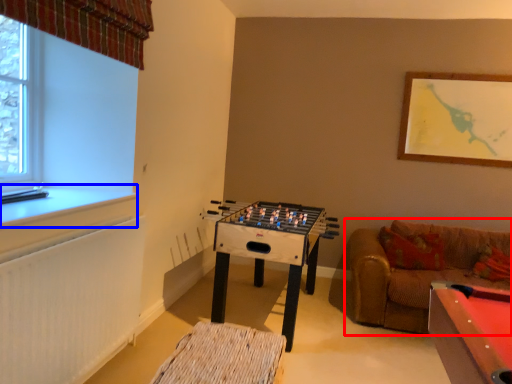
Question: Which object is closer to the camera taking this photo, studio couch (highlighted by a red box) or window sill (highlighted by a blue box)?

Choices:
 (A) studio couch
 (B) window sill

Answer: (B)